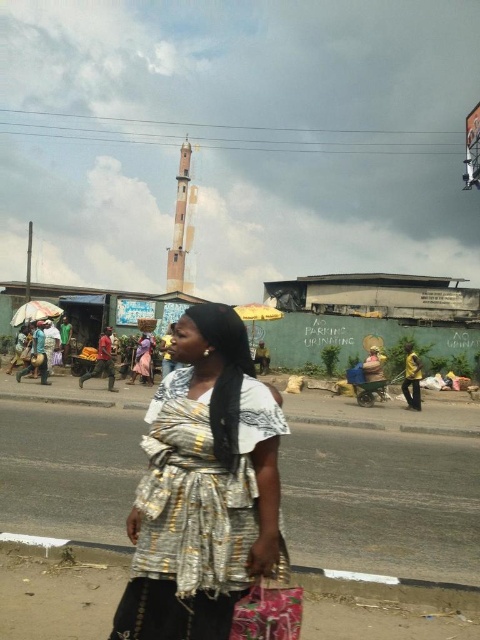
You are a photographer trying to capture the silver metallic dress at center and the floral fabric bag at lower center in the same frame. Which object should you adjust your camera to focus on first if you want to include both in your shot?

The silver metallic dress at center is to the left of floral fabric bag at lower center, so you should focus on the silver metallic dress at center first to ensure both are in the frame.

You are a photographer standing on the sidewalk in the scene. You want to take a photo of the floral fabric bag at lower center and the yellow fabric at right. Which object will appear larger in the photo?

The floral fabric bag at lower center will appear larger in the photo because it is closer to the viewer than the yellow fabric at right.

You are a photographer trying to capture the silver metallic dress at center and the yellow fabric at right in the same frame. Since you can only focus on one object at a time, which object should you focus on to ensure the other remains in the background?

You should focus on the silver metallic dress at center because it is in front of the yellow fabric at right, so the yellow fabric at right will naturally appear in the background.